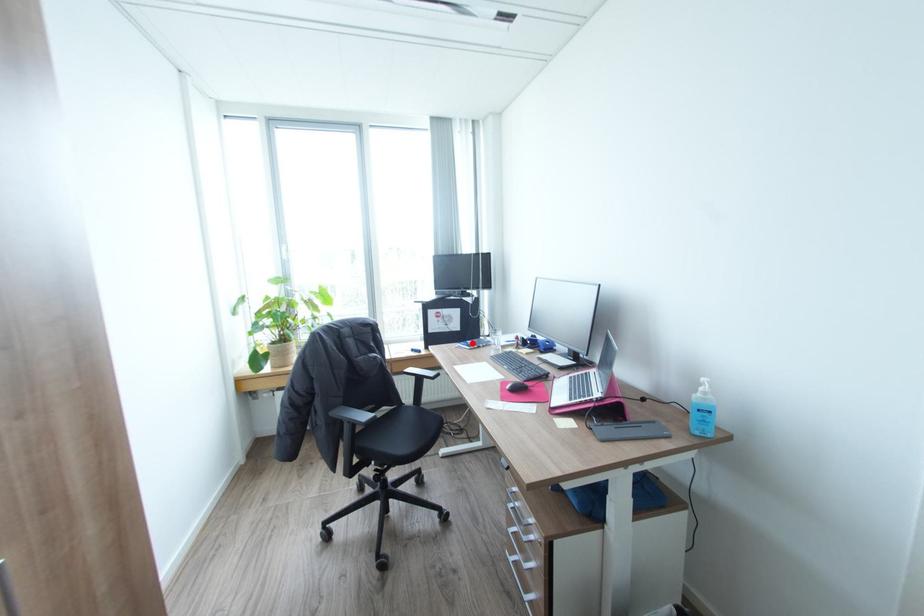
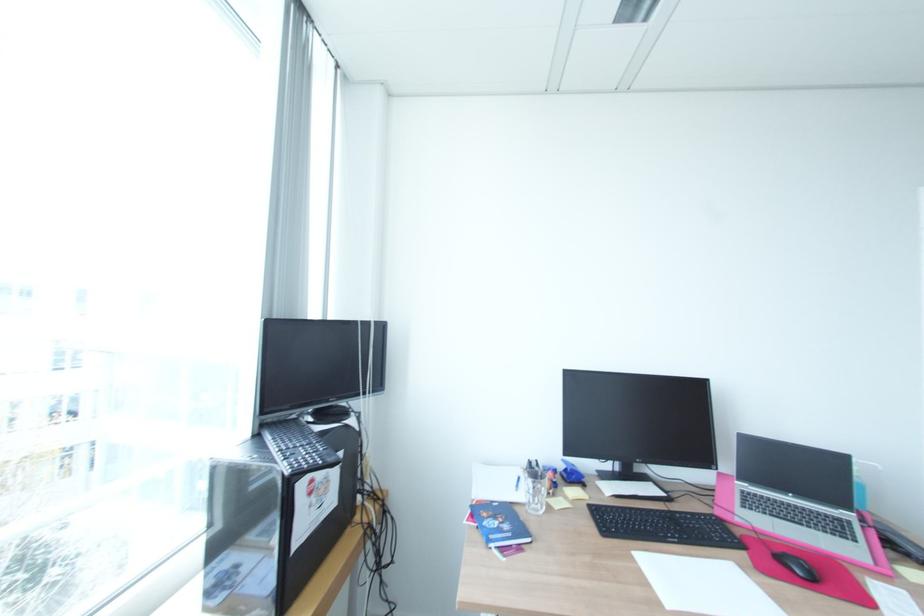
Where in the second image is the point corresponding to the highlighted location from the first image?

(504, 530)